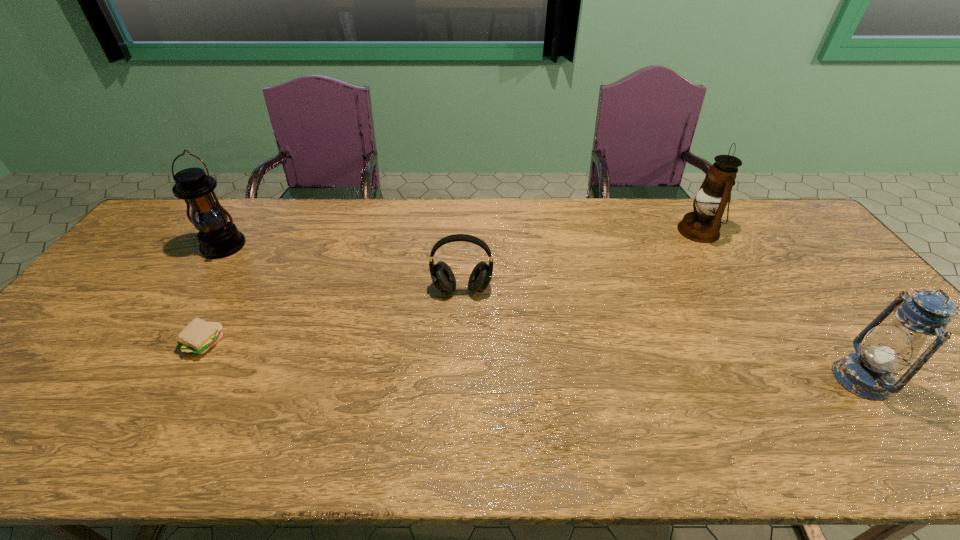
Identify the location of lantern that is the third closest to the patty. (868, 373).

At what (x,y) coordinates should I click in order to perform the action: click on lantern object that ranks as the third closest to the third farthest object. Please return your answer as a coordinate pair (x, y). Looking at the image, I should click on (868, 373).